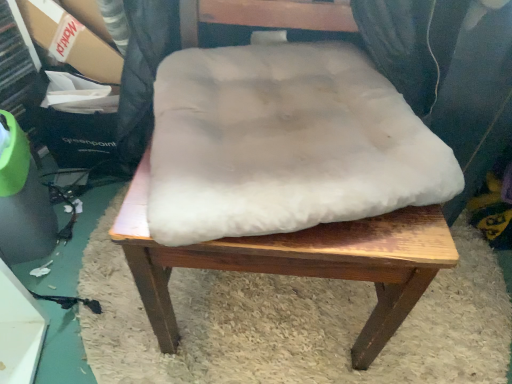
Describe the element at coordinates (284, 143) in the screenshot. This screenshot has height=384, width=512. I see `white fluffy cushion at center` at that location.

Find the location of a particular element. white fluffy cushion at center is located at coordinates (284, 143).

From a real-world perspective, who is located higher, white fluffy cushion at center or white fluffy cushion at center?

white fluffy cushion at center is physically above.

Considering the relative sizes of white fluffy cushion at center and white fluffy cushion at center in the image provided, is white fluffy cushion at center shorter than white fluffy cushion at center?

Indeed, white fluffy cushion at center has a lesser height compared to white fluffy cushion at center.

Considering the relative sizes of white fluffy cushion at center and white fluffy cushion at center in the image provided, is white fluffy cushion at center bigger than white fluffy cushion at center?

No.

Based on the photo, does white fluffy cushion at center contain white fluffy cushion at center?

Actually, white fluffy cushion at center is outside white fluffy cushion at center.

Can white fluffy cushion at center be found inside cardboard at upper left?

No.

Considering the positions of point (94, 65) and point (238, 258), is point (94, 65) closer or farther from the camera than point (238, 258)?

Point (94, 65) is farther from the camera than point (238, 258).

Considering the sizes of objects cardboard at upper left and white fluffy cushion at center in the image provided, who is smaller, cardboard at upper left or white fluffy cushion at center?

cardboard at upper left is smaller.

Consider the image. From the image's perspective, is cardboard at upper left located beneath white fluffy cushion at center?

No.

Is the position of white fluffy cushion at center more distant than that of cardboard at upper left?

That is False.

Is point (250, 154) positioned before point (104, 66)?

Yes, it is in front of point (104, 66).

Locate an element on the screen. cardboard box on the left of white fluffy cushion at center is located at coordinates (71, 41).

Could cardboard at upper left be considered to be inside white fluffy cushion at center?

No, cardboard at upper left is not surrounded by white fluffy cushion at center.

Can you confirm if white fluffy cushion at center is taller than white fluffy cushion at center?

Yes, white fluffy cushion at center is taller than white fluffy cushion at center.

From the image's perspective, is white fluffy cushion at center below white fluffy cushion at center?

Actually, white fluffy cushion at center appears above white fluffy cushion at center in the image.

Looking at this image, considering the relative sizes of white fluffy cushion at center and white fluffy cushion at center in the image provided, is white fluffy cushion at center thinner than white fluffy cushion at center?

Yes, white fluffy cushion at center is thinner than white fluffy cushion at center.

Based on the photo, does white fluffy cushion at center touch white fluffy cushion at center?

No, white fluffy cushion at center is not making contact with white fluffy cushion at center.

Which of these two, white fluffy cushion at center or white fluffy cushion at center, stands shorter?

white fluffy cushion at center.

Between white fluffy cushion at center and white fluffy cushion at center, which one is positioned behind?

white fluffy cushion at center is further from the camera.

Does point (448, 266) come behind point (378, 165)?

No, it is not.

Is white fluffy cushion at center facing towards cardboard at upper left?

No, white fluffy cushion at center is not turned towards cardboard at upper left.

Considering the positions of objects white fluffy cushion at center and cardboard at upper left in the image provided, who is more to the left, white fluffy cushion at center or cardboard at upper left?

Positioned to the left is cardboard at upper left.

Is white fluffy cushion at center wider than cardboard at upper left?

Indeed, white fluffy cushion at center has a greater width compared to cardboard at upper left.

From the image's perspective, is white fluffy cushion at center located above or below cardboard at upper left?

From the image's perspective, white fluffy cushion at center appears below cardboard at upper left.

Based on the photo, from a real-world perspective, is white fluffy cushion at center on cardboard at upper left?

Incorrect, from a real-world perspective, white fluffy cushion at center is lower than cardboard at upper left.

Locate an element on the screen. cardboard box behind the white fluffy cushion at center is located at coordinates (71, 41).

Is white fluffy cushion at center bigger than cardboard at upper left?

Indeed, white fluffy cushion at center has a larger size compared to cardboard at upper left.

Locate an element on the screen. This screenshot has width=512, height=384. chair lying below the white fluffy cushion at center (from the image's perspective) is located at coordinates (297, 262).

You are a GUI agent. You are given a task and a screenshot of the screen. Output one action in this format:
    pyautogui.click(x=<x>, y=<y>)
    Task: Click on the step stool on the right of cardboard at upper left
    Image resolution: width=512 pixels, height=384 pixels.
    Given the screenshot: What is the action you would take?
    pyautogui.click(x=301, y=264)

Considering their positions, is white fluffy cushion at center positioned closer to white fluffy cushion at center than cardboard at upper left?

white fluffy cushion at center lies closer to white fluffy cushion at center than the other object.

Estimate the real-world distances between objects in this image. Which object is closer to white fluffy cushion at center, white fluffy cushion at center or white fluffy cushion at center?

white fluffy cushion at center lies closer to white fluffy cushion at center than the other object.

Looking at the image, which one is located closer to white fluffy cushion at center, cardboard at upper left or white fluffy cushion at center?

white fluffy cushion at center is positioned closer to the anchor white fluffy cushion at center.

Estimate the real-world distances between objects in this image. Which object is closer to white fluffy cushion at center, white fluffy cushion at center or cardboard at upper left?

white fluffy cushion at center.

Looking at the image, which one is located closer to cardboard at upper left, white fluffy cushion at center or white fluffy cushion at center?

white fluffy cushion at center is positioned closer to the anchor cardboard at upper left.

When comparing their distances from white fluffy cushion at center, does white fluffy cushion at center or cardboard at upper left seem further?

Based on the image, cardboard at upper left appears to be further to white fluffy cushion at center.

Looking at the image, which one is located further to white fluffy cushion at center, white fluffy cushion at center or white fluffy cushion at center?

white fluffy cushion at center lies further to white fluffy cushion at center than the other object.

From the image, which object appears to be farther from white fluffy cushion at center, white fluffy cushion at center or cardboard at upper left?

Based on the image, cardboard at upper left appears to be further to white fluffy cushion at center.

I want to click on dog bed between white fluffy cushion at center and cardboard at upper left along the z-axis, so click(284, 143).

Locate an element on the screen. Image resolution: width=512 pixels, height=384 pixels. dog bed between cardboard at upper left and white fluffy cushion at center in the horizontal direction is located at coordinates (284, 143).

Where is `dog bed positioned between white fluffy cushion at center and white fluffy cushion at center from near to far`? This screenshot has height=384, width=512. dog bed positioned between white fluffy cushion at center and white fluffy cushion at center from near to far is located at coordinates (284, 143).

Identify the location of step stool between white fluffy cushion at center and cardboard at upper left along the z-axis. click(x=301, y=264).